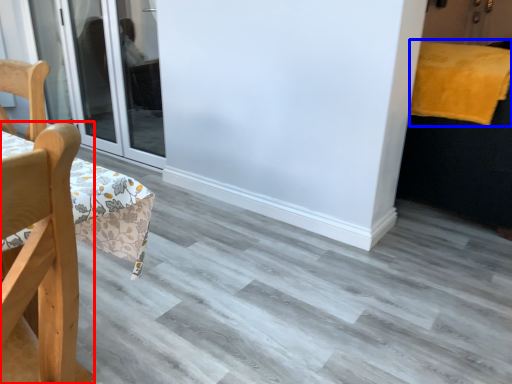
Question: Which point is further to the camera, chair (highlighted by a red box) or blanket (highlighted by a blue box)?

Choices:
 (A) chair
 (B) blanket

Answer: (B)